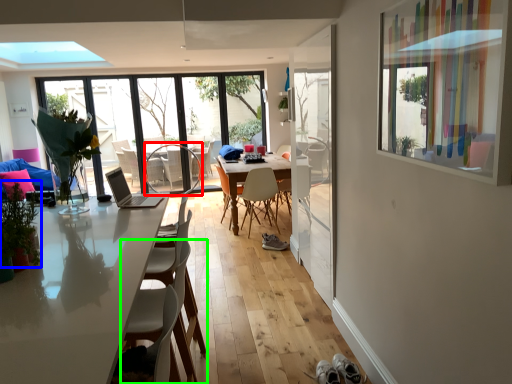
Question: Which object is positioned farthest from armchair (highlighted by a red box)? Select from plant (highlighted by a blue box) and chair (highlighted by a green box).

Choices:
 (A) plant
 (B) chair

Answer: (A)